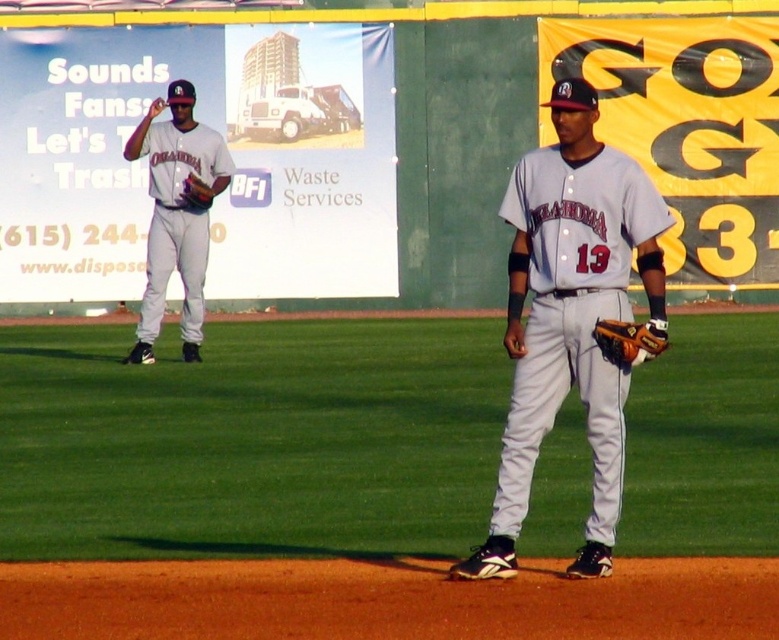
Question: Can you confirm if white uniform pants at center is positioned to the left of brown leather glove at lower right?

Choices:
 (A) yes
 (B) no

Answer: (A)

Question: Which of the following is the closest to the observer?

Choices:
 (A) (657, 349)
 (B) (284, 460)

Answer: (A)

Question: Based on their relative distances, which object is nearer to the brown leather glove at lower right?

Choices:
 (A) gray fabric baseball uniform at center
 (B) brown leather glove at left

Answer: (A)

Question: Which object is the farthest from the brown leather glove at lower right?

Choices:
 (A) matte gray uniform at left
 (B) brown leather glove at left
 (C) gray fabric baseball uniform at center
 (D) white uniform pants at center

Answer: (A)

Question: Does gray fabric baseball uniform at center appear on the right side of brown leather glove at lower right?

Choices:
 (A) yes
 (B) no

Answer: (B)

Question: Where is white uniform pants at center located in relation to brown leather glove at left in the image?

Choices:
 (A) above
 (B) below

Answer: (B)